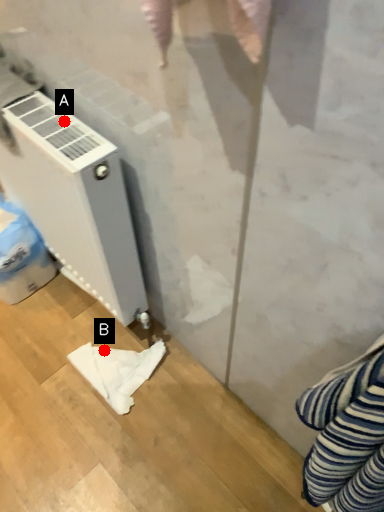
Question: Two points are circled on the image, labeled by A and B beside each circle. Which point is farther to the camera?

Choices:
 (A) A is further
 (B) B is further

Answer: (B)